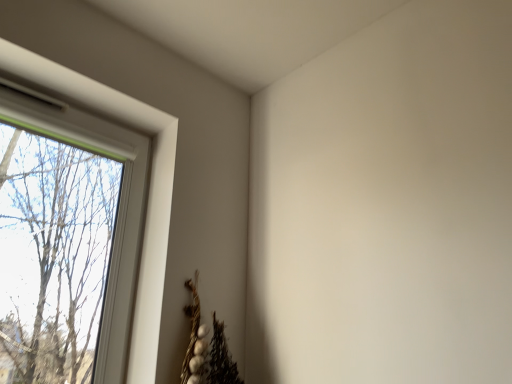
Image resolution: width=512 pixels, height=384 pixels. Describe the element at coordinates (206, 348) in the screenshot. I see `white textured wreath at lower left` at that location.

Identify the location of white textured wreath at lower left. (206, 348).

I want to click on white textured wreath at lower left, so click(206, 348).